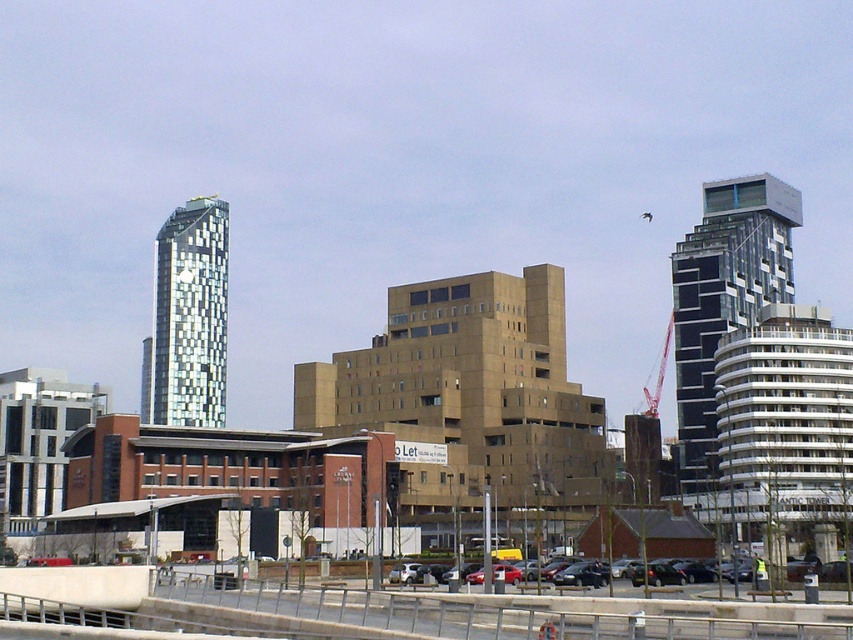
You are a pedestrian standing at the edge of the parking lot. You see a matte red car at center and a glassy black skyscraper at right. Which object is positioned to the right of the other?

The glassy black skyscraper at right is positioned to the right of the matte red car at center.

You are a delivery driver who needs to park your truck between the matte red car at center and the metallic silver car at center. Can you fit your truck, which is 6 meters long, in the available space between them?

The matte red car at center is located below the metallic silver car at center, which means they are stacked vertically rather than spaced horizontally. Therefore, there is no horizontal space between them for the truck to park.